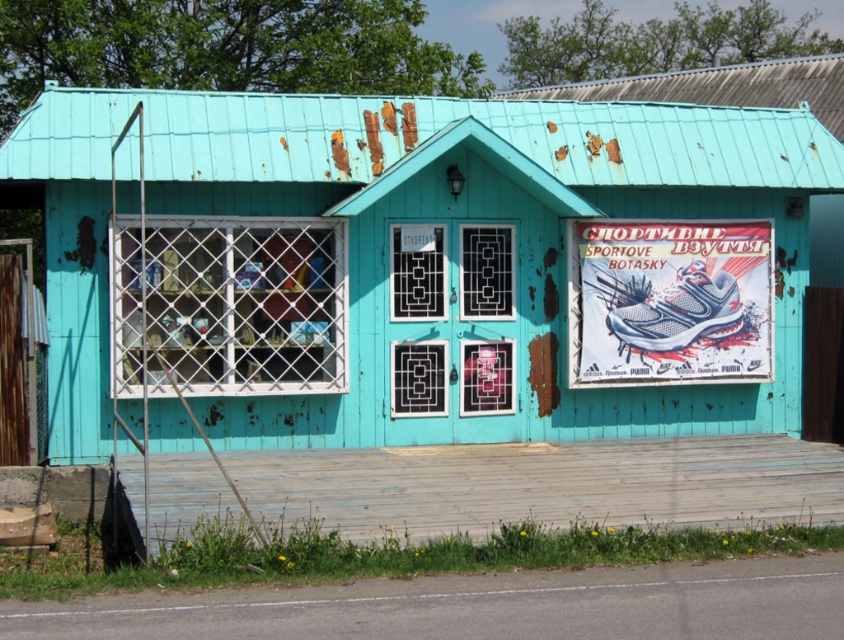
You are standing in front of the teal wooden hut at center and want to see the white paper poster at upper right. Can you see the poster without moving your head?

The teal wooden hut at center is shorter than the white paper poster at upper right, so yes, you can see the white paper poster at upper right without moving your head because the poster is taller than the hut.

You are standing in front of the faded turquoise building and want to locate two specific points marked on the facade. The first point is at coordinates point (241, 230) and the second is at point (709, 310). Which point would you see first if you were to walk directly towards the building?

Point (241, 230) is in front of point (709, 310), so you would see point (241, 230) first as you approach the building.